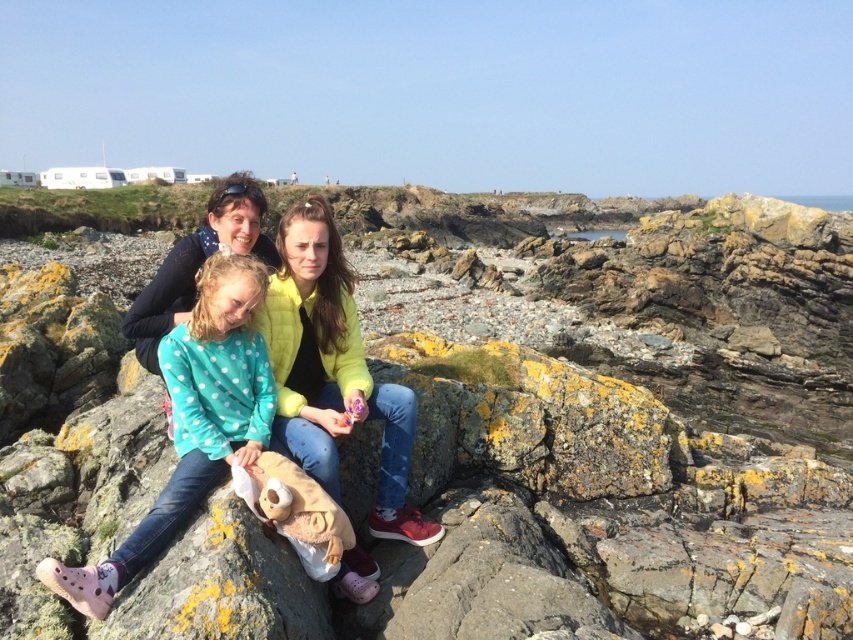
Is point (717, 352) less distant than point (300, 337)?

That is False.

Does rough textured rock at center appear on the right side of yellow quilted jacket at center?

No, rough textured rock at center is not to the right of yellow quilted jacket at center.

Does point (439, 470) come farther from viewer compared to point (273, 369)?

No, (439, 470) is closer to viewer.

This screenshot has width=853, height=640. Identify the location of rough textured rock at center. (631, 433).

Does yellow quilted jacket at center have a smaller size compared to teal polka dot sweater at center?

Actually, yellow quilted jacket at center might be larger than teal polka dot sweater at center.

Between point (289, 278) and point (250, 344), which one is positioned behind?

Positioned behind is point (289, 278).

The width and height of the screenshot is (853, 640). Identify the location of yellow quilted jacket at center. (332, 371).

Is rough textured rock at center to the right of teal polka dot sweater at center from the viewer's perspective?

Indeed, rough textured rock at center is positioned on the right side of teal polka dot sweater at center.

Is point (799, 241) closer to viewer compared to point (258, 435)?

No.

The height and width of the screenshot is (640, 853). I want to click on rough textured rock at center, so click(x=631, y=433).